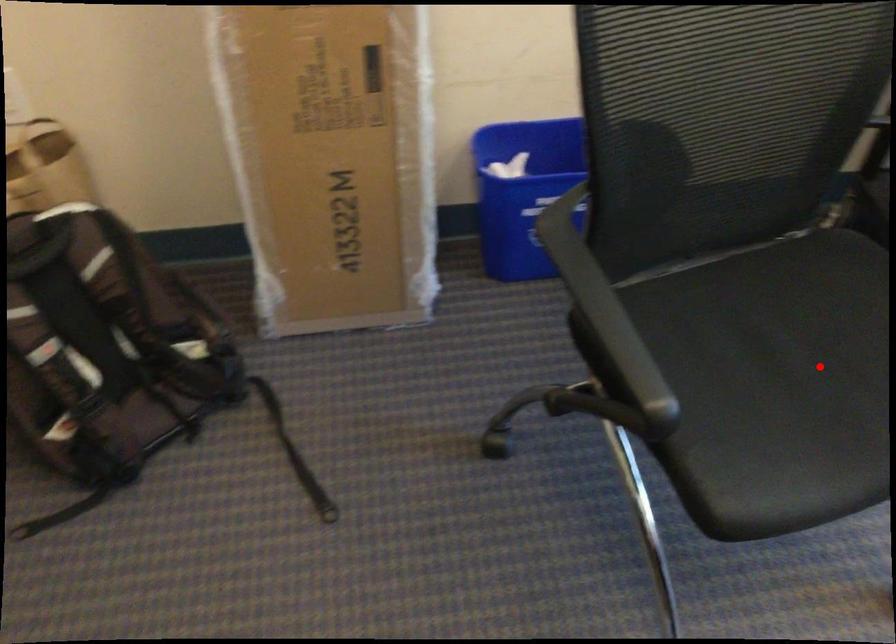
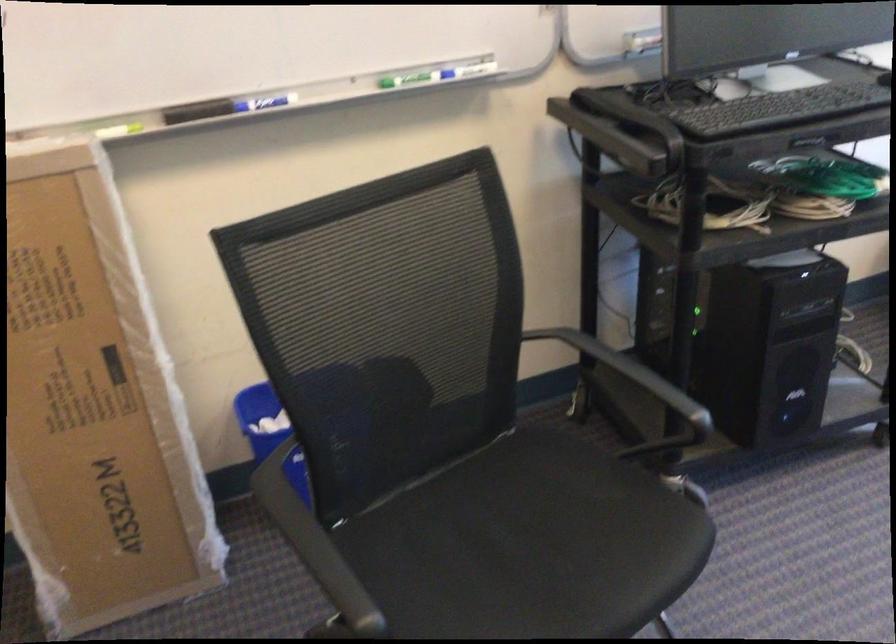
Question: I am providing you with two images of the same scene from different viewpoints. In image1, a red point is highlighted. Considering the same 3D point in image2, which of the following is correct?

Choices:
 (A) It is closer
 (B) It is farther

Answer: (B)